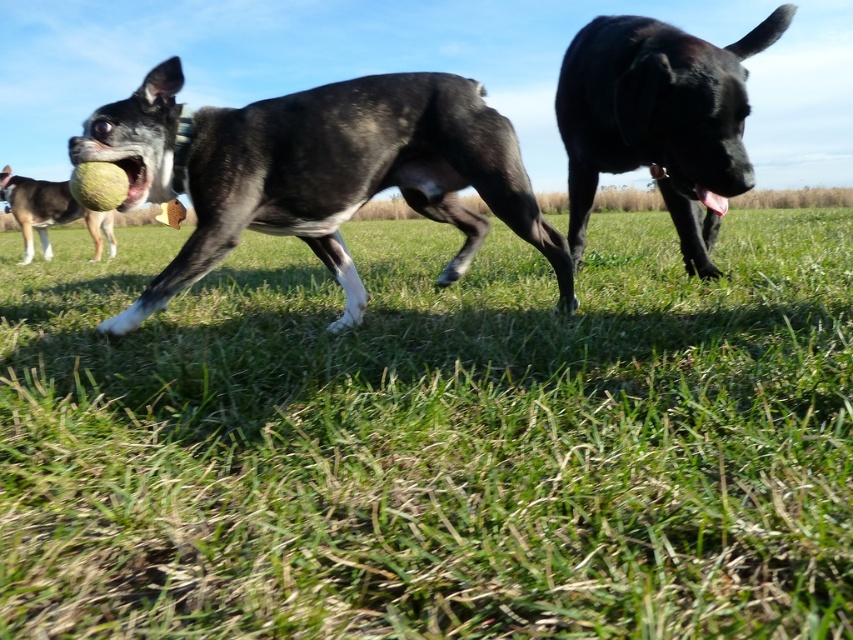
Does green grass at center have a larger size compared to black matte dog at center?

Actually, green grass at center might be smaller than black matte dog at center.

Which of these two, green grass at center or black matte dog at center, stands shorter?

Standing shorter between the two is green grass at center.

Between point (328, 566) and point (618, 170), which one is positioned in front?

Point (328, 566) is more forward.

Identify the location of green grass at center. (433, 440).

Is point (357, 196) more distant than point (33, 211)?

No, it is in front of (33, 211).

Measure the distance between black glossy dog at center and camera.

black glossy dog at center is 7.60 feet away from camera.

This screenshot has width=853, height=640. What do you see at coordinates (317, 172) in the screenshot?
I see `black glossy dog at center` at bounding box center [317, 172].

Locate an element on the screen. black glossy dog at center is located at coordinates (317, 172).

Can you confirm if black matte dog at center is thinner than shiny black tennis ball at center?

Correct, black matte dog at center's width is less than shiny black tennis ball at center's.

What do you see at coordinates (659, 120) in the screenshot? I see `black matte dog at center` at bounding box center [659, 120].

Find the location of a particular element. black matte dog at center is located at coordinates (659, 120).